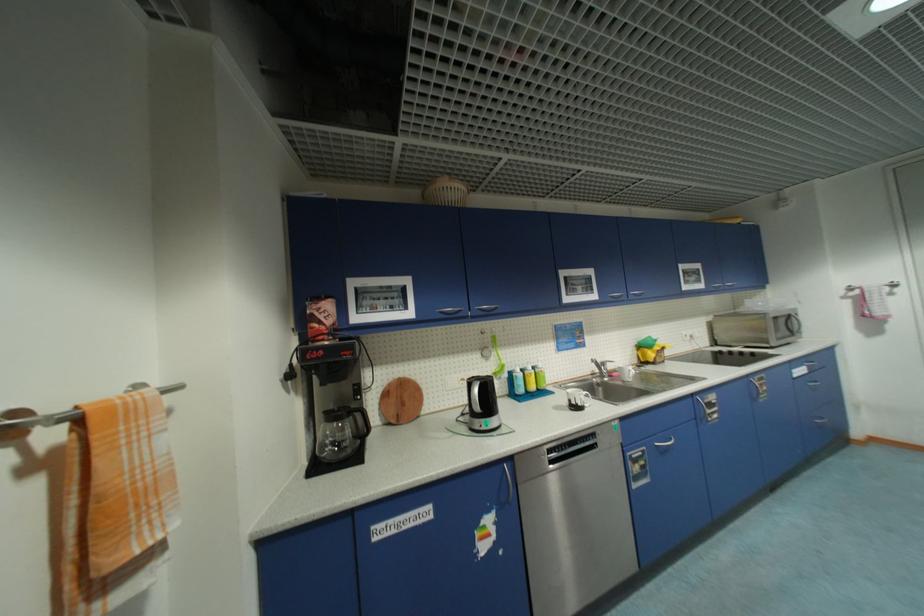
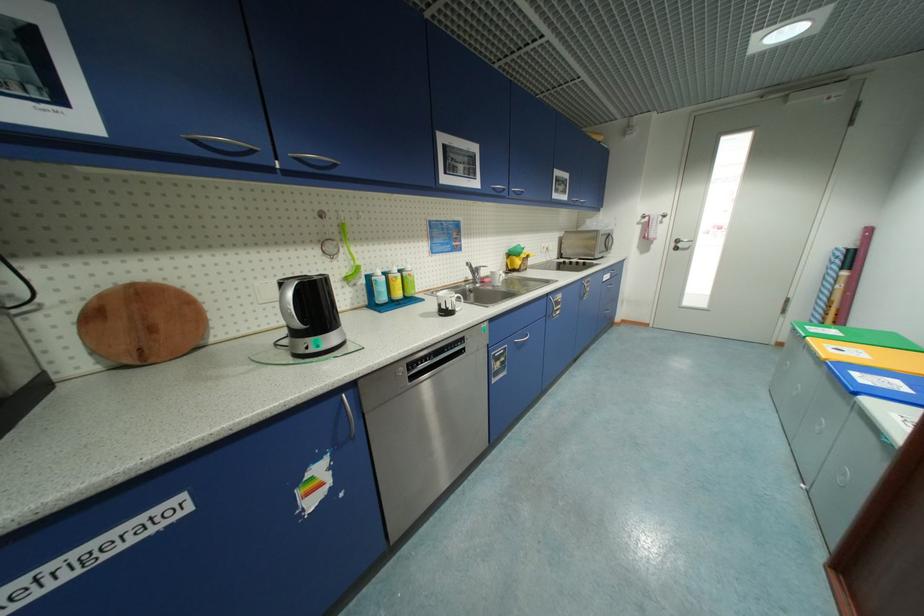
The point at (x=616, y=297) is marked in the first image. Where is the corresponding point in the second image?

(499, 190)